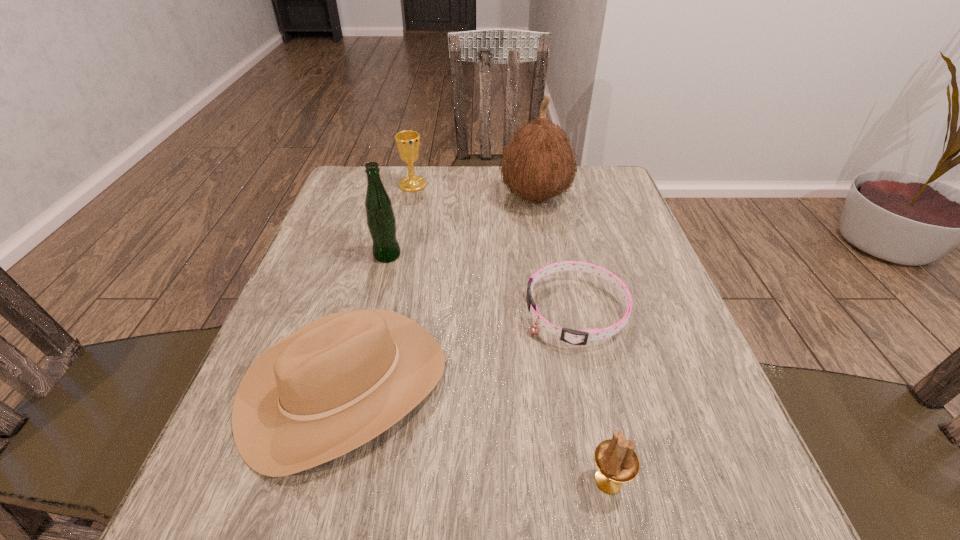
Identify the location of free area in between the candle holder and the cowboy hat. The width and height of the screenshot is (960, 540). (476, 434).

Where is `vacant area that lies between the fifth shortest object and the coconut`? vacant area that lies between the fifth shortest object and the coconut is located at coordinates (461, 226).

Image resolution: width=960 pixels, height=540 pixels. Identify the location of object that stands as the closest to the candle holder. (576, 337).

This screenshot has width=960, height=540. In order to click on the fifth closest object to the fourth nearest object in this screenshot , I will do `click(616, 460)`.

The image size is (960, 540). What are the coordinates of `vacant space that satisfies the following two spatial constraints: 1. on the back side of the candle holder; 2. on the surface of the tallest object` in the screenshot? It's located at (547, 197).

Image resolution: width=960 pixels, height=540 pixels. I want to click on vacant region that satisfies the following two spatial constraints: 1. on the surface of the coconut; 2. on the left side of the candle holder, so click(584, 481).